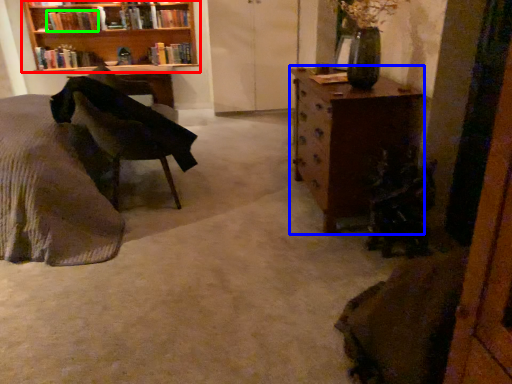
Question: Which is farther away from bookcase (highlighted by a red box)? chest of drawers (highlighted by a blue box) or book (highlighted by a green box)?

Choices:
 (A) chest of drawers
 (B) book

Answer: (A)